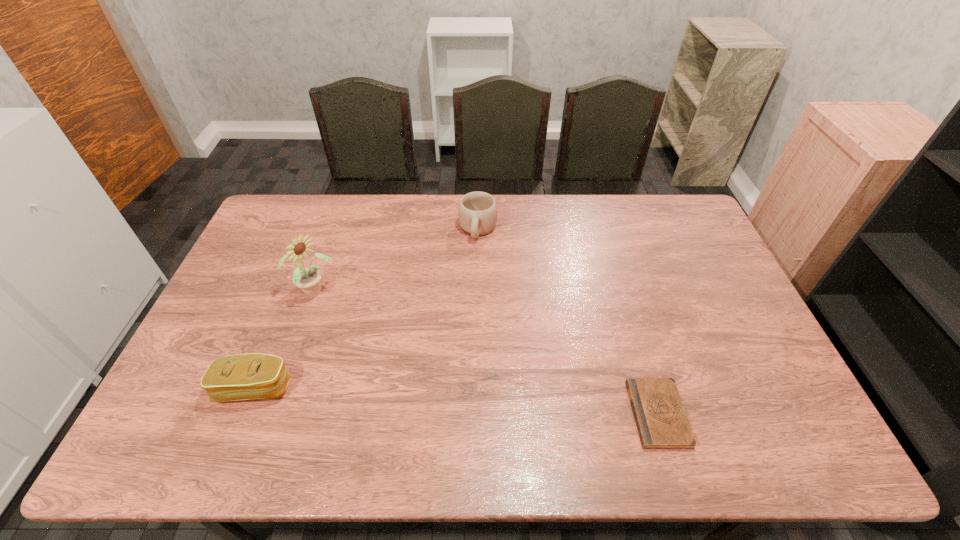
Identify the location of free space on the desktop that is between the clutch bag and the shortest object and is positioned on the front-facing side of the tallest object. (465, 401).

Where is `free space on the desktop that is between the clutch bag and the shortest object and is positioned on the side of the third object from left to right with the handle`? The image size is (960, 540). free space on the desktop that is between the clutch bag and the shortest object and is positioned on the side of the third object from left to right with the handle is located at coordinates (445, 400).